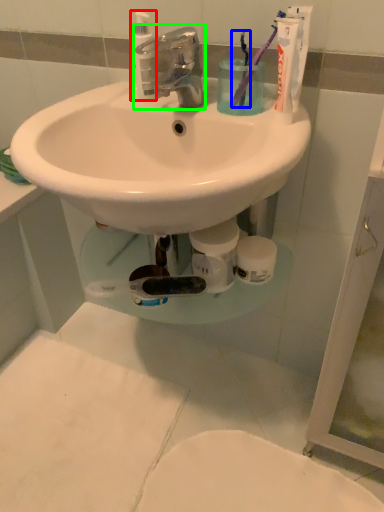
Question: Which is nearer to the cleaning product (highlighted by a red box)? toothbrush (highlighted by a blue box) or tap (highlighted by a green box).

Choices:
 (A) toothbrush
 (B) tap

Answer: (B)